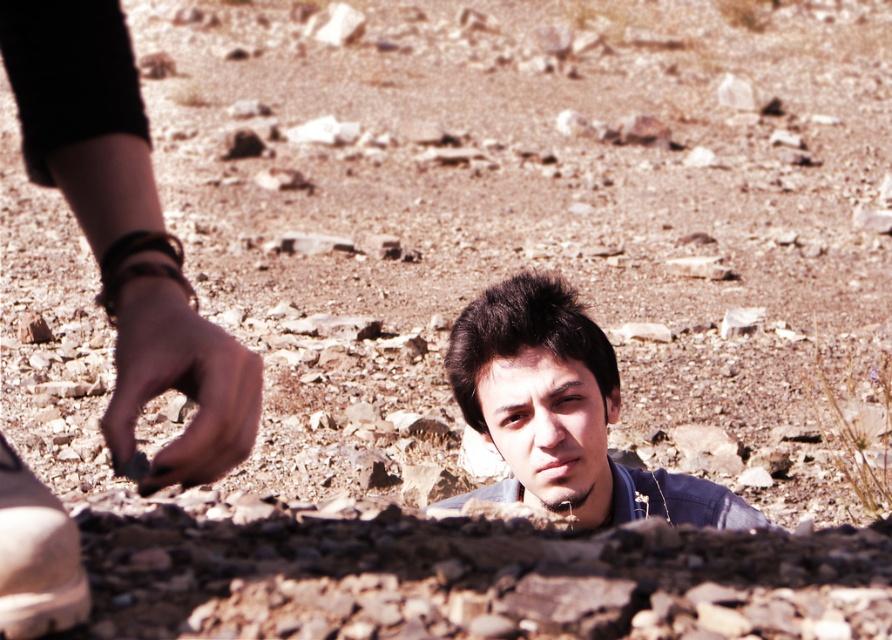
Does dark blue shirt at center appear on the right side of white matte shoe at lower left?

Indeed, dark blue shirt at center is positioned on the right side of white matte shoe at lower left.

Is dark blue shirt at center shorter than white matte shoe at lower left?

Incorrect, dark blue shirt at center's height does not fall short of white matte shoe at lower left's.

Who is more forward, [453,326] or [88,593]?

Point [88,593]

This screenshot has height=640, width=892. I want to click on dark blue shirt at center, so click(x=560, y=412).